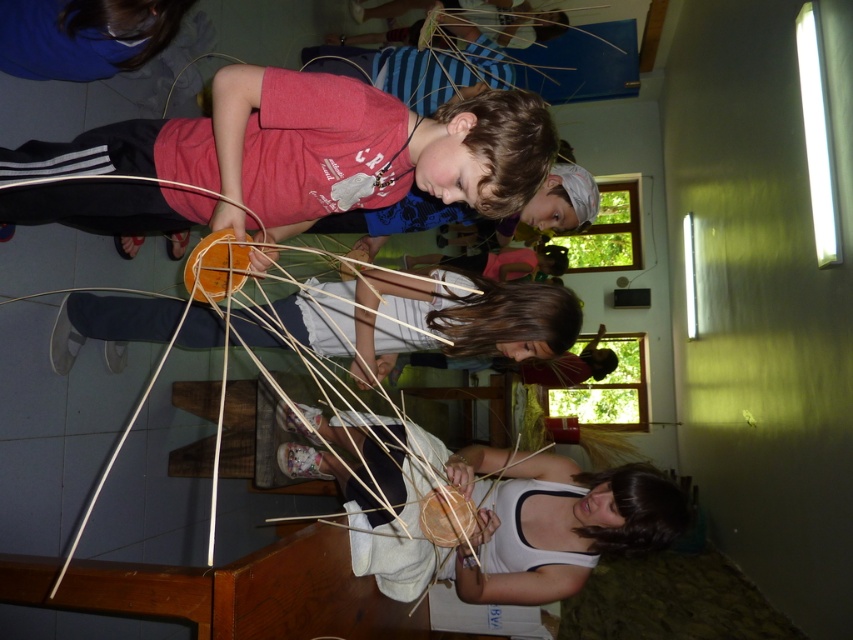
Between natural straw basket at lower center and natural straw basket at center, which one has more height?

natural straw basket at lower center is taller.

Who is shorter, natural straw basket at lower center or natural straw basket at center?

natural straw basket at center is shorter.

Where is `natural straw basket at lower center`? The height and width of the screenshot is (640, 853). natural straw basket at lower center is located at coordinates (480, 509).